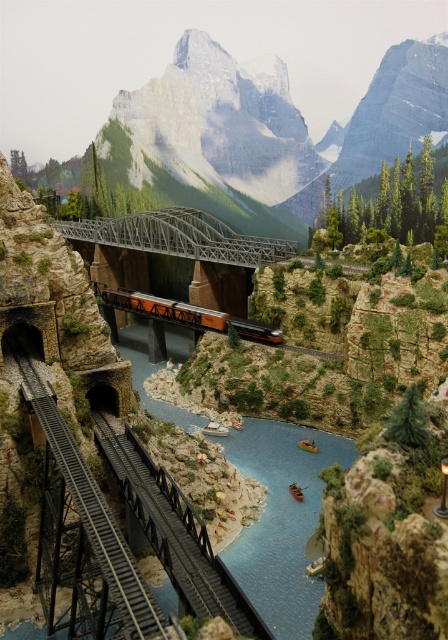
Is metallic bridge at center to the right of metallic silver train at center from the viewer's perspective?

No, metallic bridge at center is not to the right of metallic silver train at center.

Which is more to the right, metallic bridge at center or metallic silver train at center?

metallic silver train at center is more to the right.

Between point (133, 214) and point (180, 317), which one is positioned in front?

Point (180, 317)

Image resolution: width=448 pixels, height=640 pixels. I want to click on metallic bridge at center, so click(180, 236).

Who is lower down, blue glossy water at center or black metal train track at lower left?

Positioned lower is black metal train track at lower left.

Is blue glossy water at center bigger than black metal train track at lower left?

Indeed, blue glossy water at center has a larger size compared to black metal train track at lower left.

Is point (313, 582) positioned behind point (26, 376)?

No, it is not.

The image size is (448, 640). What are the coordinates of `blue glossy water at center` in the screenshot? It's located at (280, 520).

Which is above, black metal train track at lower left or metallic bridge at center?

metallic bridge at center is higher up.

Is black metal train track at lower left in front of metallic bridge at center?

That is True.

You are a GUI agent. You are given a task and a screenshot of the screen. Output one action in this format:
    pyautogui.click(x=<x>, y=<y>)
    Task: Click on the black metal train track at lower left
    This screenshot has width=448, height=640.
    Given the screenshot: What is the action you would take?
    (81, 534)